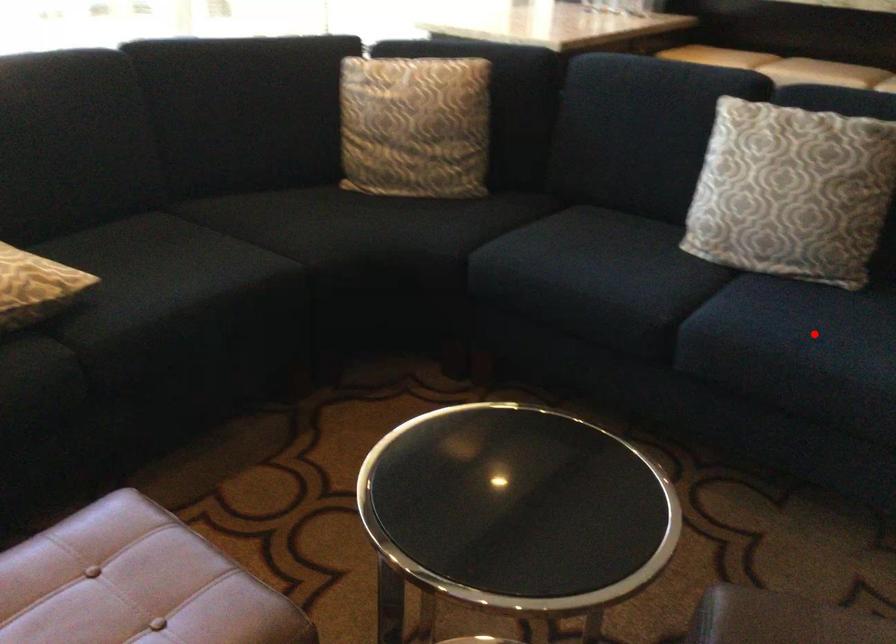
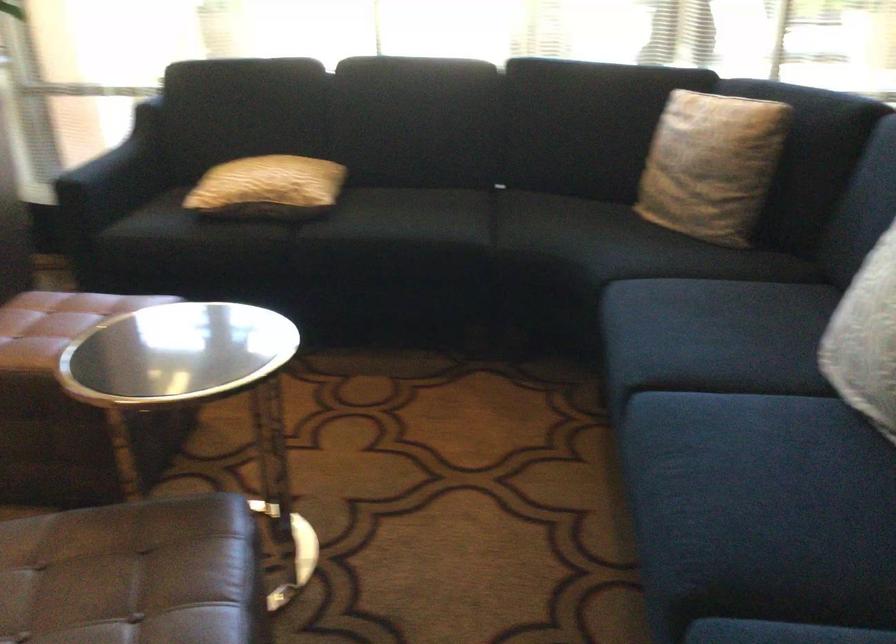
In the second image, find the point that corresponds to the highlighted location in the first image.

(745, 459)